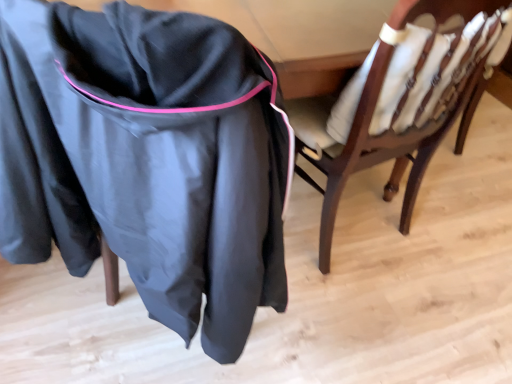
The height and width of the screenshot is (384, 512). I want to click on matte black jacket at left, so click(x=147, y=158).

What is the approximate height of matte black jacket at left?

The height of matte black jacket at left is 37.38 inches.

The image size is (512, 384). What do you see at coordinates (147, 158) in the screenshot?
I see `matte black jacket at left` at bounding box center [147, 158].

The width and height of the screenshot is (512, 384). Find the location of `wooden chair with white cushions at center`. wooden chair with white cushions at center is located at coordinates (388, 103).

This screenshot has height=384, width=512. What do you see at coordinates (388, 103) in the screenshot?
I see `wooden chair with white cushions at center` at bounding box center [388, 103].

Locate an element on the screen. The image size is (512, 384). matte black jacket at left is located at coordinates (147, 158).

Considering the relative positions of matte black jacket at left and wooden chair with white cushions at center in the image provided, is matte black jacket at left to the right of wooden chair with white cushions at center from the viewer's perspective?

In fact, matte black jacket at left is to the left of wooden chair with white cushions at center.

Is the position of matte black jacket at left less distant than that of wooden chair with white cushions at center?

Yes, matte black jacket at left is in front of wooden chair with white cushions at center.

Does point (198, 53) come closer to viewer compared to point (324, 197)?

That is True.

From the image's perspective, does matte black jacket at left appear lower than wooden chair with white cushions at center?

Yes, from the image's perspective, matte black jacket at left is below wooden chair with white cushions at center.

From a real-world perspective, is matte black jacket at left physically located above or below wooden chair with white cushions at center?

matte black jacket at left is above wooden chair with white cushions at center.

In terms of width, does matte black jacket at left look wider or thinner when compared to wooden chair with white cushions at center?

Considering their sizes, matte black jacket at left looks broader than wooden chair with white cushions at center.

Considering the sizes of objects matte black jacket at left and wooden chair with white cushions at center in the image provided, who is shorter, matte black jacket at left or wooden chair with white cushions at center?

Standing shorter between the two is wooden chair with white cushions at center.

Is matte black jacket at left smaller than wooden chair with white cushions at center?

Actually, matte black jacket at left might be larger than wooden chair with white cushions at center.

Is wooden chair with white cushions at center completely or partially inside matte black jacket at left?

No, wooden chair with white cushions at center is located outside of matte black jacket at left.

Are matte black jacket at left and wooden chair with white cushions at center located far from each other?

matte black jacket at left is near wooden chair with white cushions at center, not far away.

Is matte black jacket at left turned away from wooden chair with white cushions at center?

matte black jacket at left does not have its back to wooden chair with white cushions at center.

How much distance is there between matte black jacket at left and wooden chair with white cushions at center?

matte black jacket at left and wooden chair with white cushions at center are 18.56 inches apart.

In order to click on clothing below the wooden chair with white cushions at center (from the image's perspective) in this screenshot , I will do `click(147, 158)`.

Which object is positioned more to the left, wooden chair with white cushions at center or matte black jacket at left?

From the viewer's perspective, matte black jacket at left appears more on the left side.

Does wooden chair with white cushions at center lie behind matte black jacket at left?

That is True.

Does point (328, 228) lie in front of point (22, 260)?

No.

Looking at this image, from the image's perspective, is wooden chair with white cushions at center located above or below matte black jacket at left?

From the image's perspective, wooden chair with white cushions at center appears above matte black jacket at left.

From a real-world perspective, which object rests below the other?

wooden chair with white cushions at center.

Which of these two, wooden chair with white cushions at center or matte black jacket at left, is thinner?

With smaller width is wooden chair with white cushions at center.

Considering the sizes of wooden chair with white cushions at center and matte black jacket at left in the image, is wooden chair with white cushions at center taller or shorter than matte black jacket at left?

Clearly, wooden chair with white cushions at center is shorter compared to matte black jacket at left.

Is wooden chair with white cushions at center bigger or smaller than matte black jacket at left?

Considering their sizes, wooden chair with white cushions at center takes up less space than matte black jacket at left.

Can matte black jacket at left be found inside wooden chair with white cushions at center?

That's incorrect, matte black jacket at left is not inside wooden chair with white cushions at center.

Is wooden chair with white cushions at center directly adjacent to matte black jacket at left?

No, wooden chair with white cushions at center is not next to matte black jacket at left.

Is wooden chair with white cushions at center oriented towards matte black jacket at left?

No, wooden chair with white cushions at center does not turn towards matte black jacket at left.

How different are the orientations of wooden chair with white cushions at center and matte black jacket at left in degrees?

36.1 degrees separate the facing orientations of wooden chair with white cushions at center and matte black jacket at left.

Where is `chair on the right side of matte black jacket at left`? chair on the right side of matte black jacket at left is located at coordinates (388, 103).

Locate an element on the screen. This screenshot has width=512, height=384. chair above the matte black jacket at left (from the image's perspective) is located at coordinates (388, 103).

At what (x,y) coordinates should I click in order to perform the action: click on chair directly beneath the matte black jacket at left (from a real-world perspective). Please return your answer as a coordinate pair (x, y). The width and height of the screenshot is (512, 384). Looking at the image, I should click on coord(388,103).